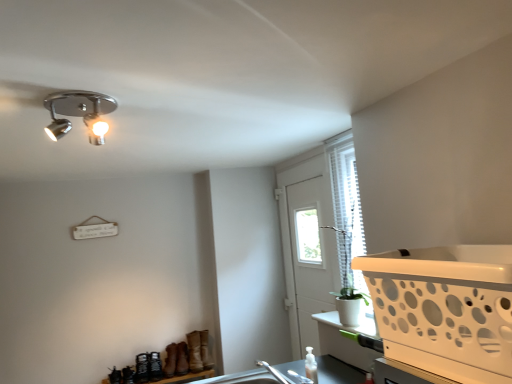
Question: Can you confirm if translucent plastic bottle at lower center is smaller than white plastic basket at right?

Choices:
 (A) no
 (B) yes

Answer: (B)

Question: Is translucent plastic bottle at lower center to the left of white plastic basket at right from the viewer's perspective?

Choices:
 (A) no
 (B) yes

Answer: (B)

Question: Does translucent plastic bottle at lower center touch white plastic basket at right?

Choices:
 (A) yes
 (B) no

Answer: (B)

Question: Is translucent plastic bottle at lower center completely or partially outside of white plastic basket at right?

Choices:
 (A) no
 (B) yes

Answer: (B)

Question: From the image's perspective, does translucent plastic bottle at lower center appear higher than white plastic basket at right?

Choices:
 (A) no
 (B) yes

Answer: (A)

Question: From a real-world perspective, is white plastic basket at right physically located above or below translucent plastic bottle at lower center?

Choices:
 (A) below
 (B) above

Answer: (B)

Question: Is point (485, 253) positioned closer to the camera than point (309, 362)?

Choices:
 (A) closer
 (B) farther

Answer: (A)

Question: From the image's perspective, is white plastic basket at right located above or below translucent plastic bottle at lower center?

Choices:
 (A) below
 (B) above

Answer: (B)

Question: Is white plastic basket at right taller or shorter than translucent plastic bottle at lower center?

Choices:
 (A) short
 (B) tall

Answer: (B)

Question: Considering the relative positions of translucent plastic bottle at lower center and white plastic screen door at center in the image provided, is translucent plastic bottle at lower center to the left or to the right of white plastic screen door at center?

Choices:
 (A) left
 (B) right

Answer: (A)

Question: From the image's perspective, is translucent plastic bottle at lower center positioned above or below white plastic screen door at center?

Choices:
 (A) below
 (B) above

Answer: (A)

Question: Is translucent plastic bottle at lower center wider or thinner than white plastic screen door at center?

Choices:
 (A) thin
 (B) wide

Answer: (A)

Question: Relative to white plastic screen door at center, is translucent plastic bottle at lower center in front or behind?

Choices:
 (A) front
 (B) behind

Answer: (A)

Question: Looking at their shapes, would you say white plastic screen door at center is wider or thinner than translucent plastic bottle at lower center?

Choices:
 (A) wide
 (B) thin

Answer: (A)

Question: Is white plastic screen door at center in front of or behind translucent plastic bottle at lower center in the image?

Choices:
 (A) behind
 (B) front

Answer: (A)